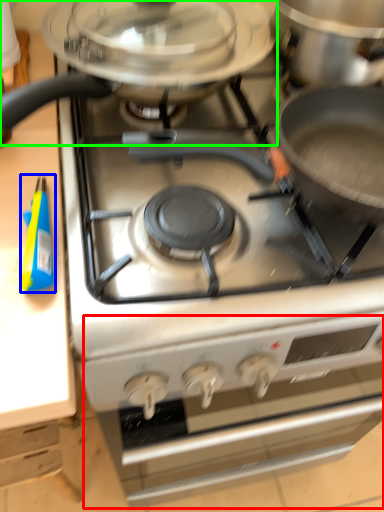
Question: Which object is positioned closest to oven (highlighted by a red box)? Select from appliance (highlighted by a blue box) and kitchen appliance (highlighted by a green box).

Choices:
 (A) appliance
 (B) kitchen appliance

Answer: (B)